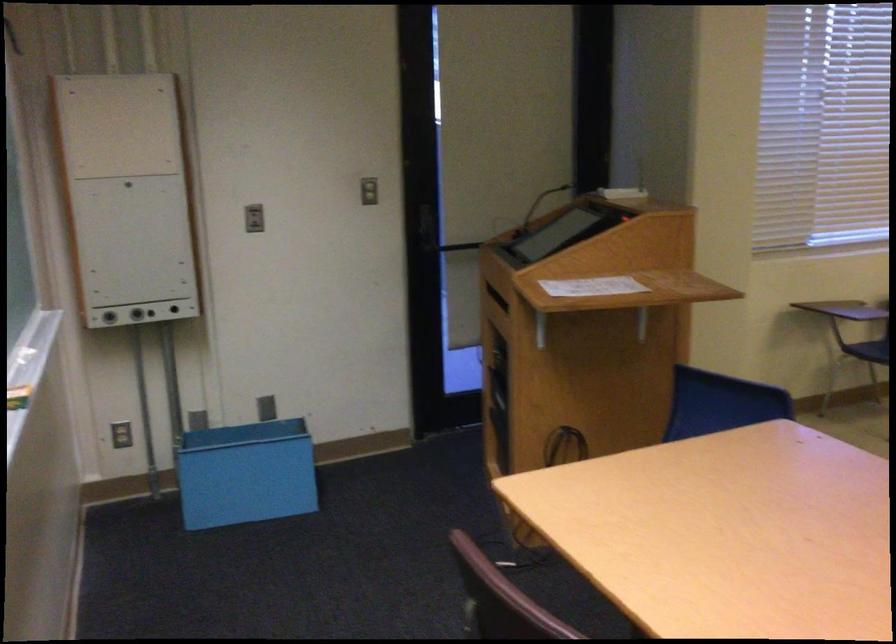
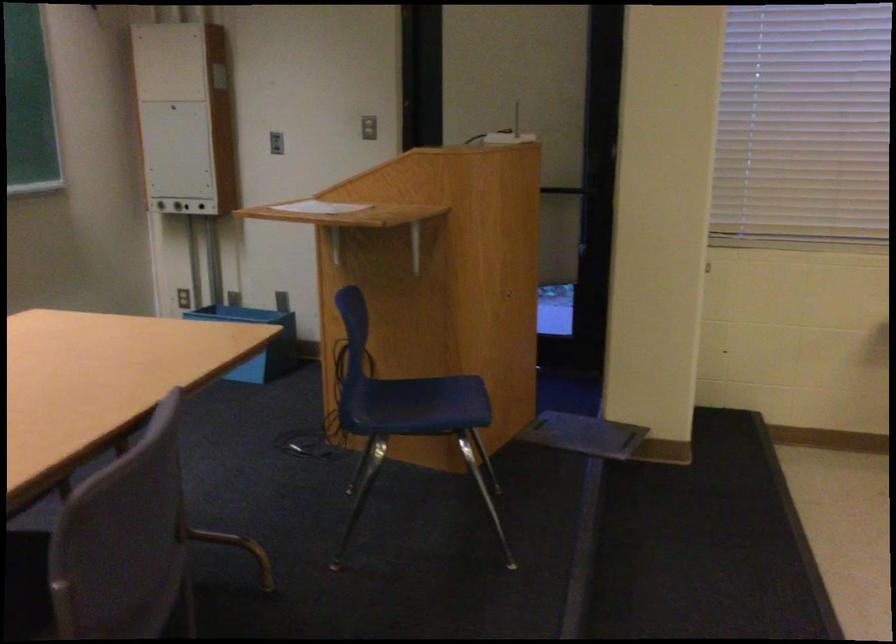
Where in the second image is the point corresponding to (604,193) from the first image?

(503, 136)